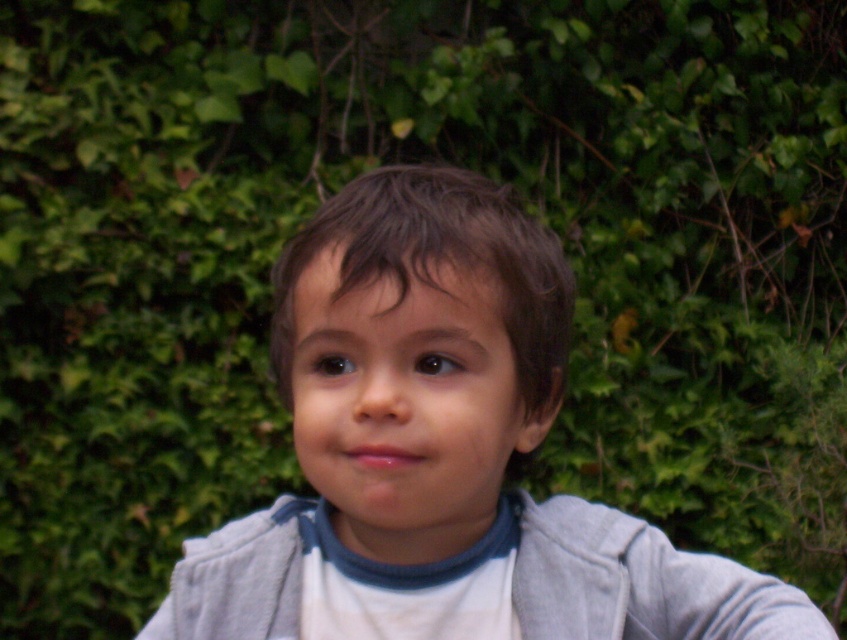
You are a photographer adjusting your camera settings to focus on the matte gray hoodie at center. The camera has a focus grid with coordinates from 0 to 1 on both axes. What are the coordinates where you should aim the focus point?

The matte gray hoodie at center is located at point (441, 451), so you should aim the focus point at those coordinates to ensure proper focus.

You are a clothing designer examining the image of a child wearing two layers. You need to determine which layer is the outermost garment. Based on the size difference between the matte gray hoodie at center and the gray fleece jacket at center, which one is the larger garment?

The matte gray hoodie at center is bigger than the gray fleece jacket at center, so the matte gray hoodie at center is the outermost layer.